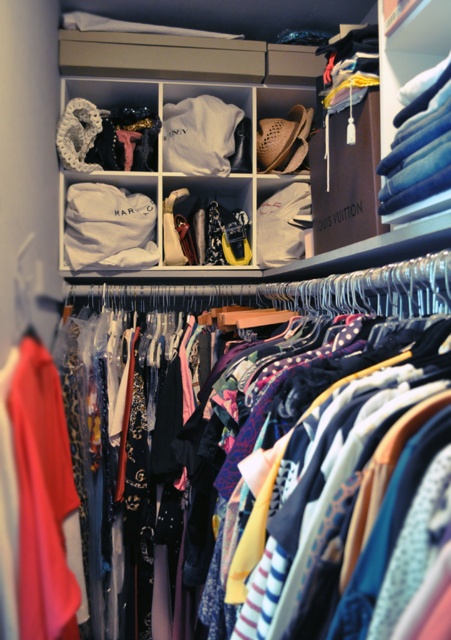
Can you confirm if white fabric at upper center is positioned below matte white shoes at center?

Actually, white fabric at upper center is above matte white shoes at center.

Can you confirm if white fabric at upper center is thinner than matte white shoes at center?

No, white fabric at upper center is not thinner than matte white shoes at center.

Does point (244, 259) come closer to viewer compared to point (230, 180)?

Yes, it is.

At what (x,y) coordinates should I click in order to perform the action: click on white fabric at upper center. Please return your answer as a coordinate pair (x, y). Looking at the image, I should click on pos(205,186).

The height and width of the screenshot is (640, 451). Describe the element at coordinates (41, 497) in the screenshot. I see `matte red dress at left` at that location.

Who is shorter, matte red dress at left or matte white shoes at center?

matte white shoes at center

Identify the location of matte red dress at left. The width and height of the screenshot is (451, 640). (41, 497).

Between matte red dress at left and denim jeans at upper right, which one appears on the right side from the viewer's perspective?

denim jeans at upper right is more to the right.

From the picture: Measure the distance between matte red dress at left and camera.

matte red dress at left and camera are 3.58 feet apart.

Is point (32, 512) positioned behind point (419, 115)?

Yes, it is behind point (419, 115).

At what (x,y) coordinates should I click in order to perform the action: click on matte red dress at left. Please return your answer as a coordinate pair (x, y). Looking at the image, I should click on (41, 497).